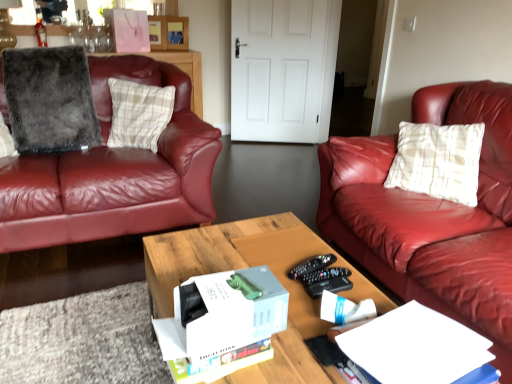
Question: Is black plastic remote control at center at the right side of white cardboard box at center?

Choices:
 (A) yes
 (B) no

Answer: (A)

Question: Is black plastic remote control at center further to camera compared to white cardboard box at center?

Choices:
 (A) no
 (B) yes

Answer: (B)

Question: Is black plastic remote control at center smaller than white cardboard box at center?

Choices:
 (A) yes
 (B) no

Answer: (A)

Question: Is black plastic remote control at center wider than white cardboard box at center?

Choices:
 (A) yes
 (B) no

Answer: (B)

Question: Is black plastic remote control at center thinner than white cardboard box at center?

Choices:
 (A) yes
 (B) no

Answer: (A)

Question: From the image's perspective, relative to plaid fabric pillow at left, the 2th pillow from the left, is white paper at lower right above or below?

Choices:
 (A) below
 (B) above

Answer: (A)

Question: In terms of width, does white paper at lower right look wider or thinner when compared to plaid fabric pillow at left, the first pillow viewed from the right?

Choices:
 (A) thin
 (B) wide

Answer: (B)

Question: Is white paper at lower right to the left or to the right of plaid fabric pillow at left, the 2th pillow from the left, in the image?

Choices:
 (A) right
 (B) left

Answer: (A)

Question: Looking at the image, does white paper at lower right seem bigger or smaller compared to plaid fabric pillow at left, the 2th pillow from the left?

Choices:
 (A) small
 (B) big

Answer: (A)

Question: Looking at their shapes, would you say gray fluffy pillow at left, the 2th pillow positioned from the right, is wider or thinner than translucent glass bottle at upper left?

Choices:
 (A) wide
 (B) thin

Answer: (A)

Question: From their relative heights in the image, would you say gray fluffy pillow at left, which is the first pillow from left to right, is taller or shorter than translucent glass bottle at upper left?

Choices:
 (A) tall
 (B) short

Answer: (A)

Question: From a real-world perspective, is gray fluffy pillow at left, which is the first pillow from left to right, above or below translucent glass bottle at upper left?

Choices:
 (A) above
 (B) below

Answer: (B)

Question: Is gray fluffy pillow at left, which is the first pillow from left to right, to the left or to the right of translucent glass bottle at upper left in the image?

Choices:
 (A) right
 (B) left

Answer: (A)

Question: Does point (237, 337) appear closer or farther from the camera than point (152, 288)?

Choices:
 (A) closer
 (B) farther

Answer: (A)

Question: In terms of size, does white cardboard box at center appear bigger or smaller than wooden coffee table at center?

Choices:
 (A) small
 (B) big

Answer: (A)